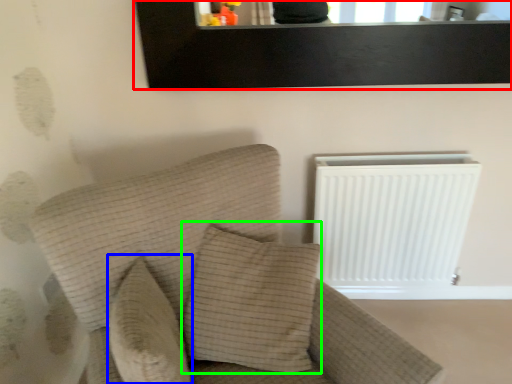
Question: Estimate the real-world distances between objects in this image. Which object is closer to picture frame (highlighted by a red box), pillow (highlighted by a blue box) or pillow (highlighted by a green box)?

Choices:
 (A) pillow
 (B) pillow

Answer: (B)